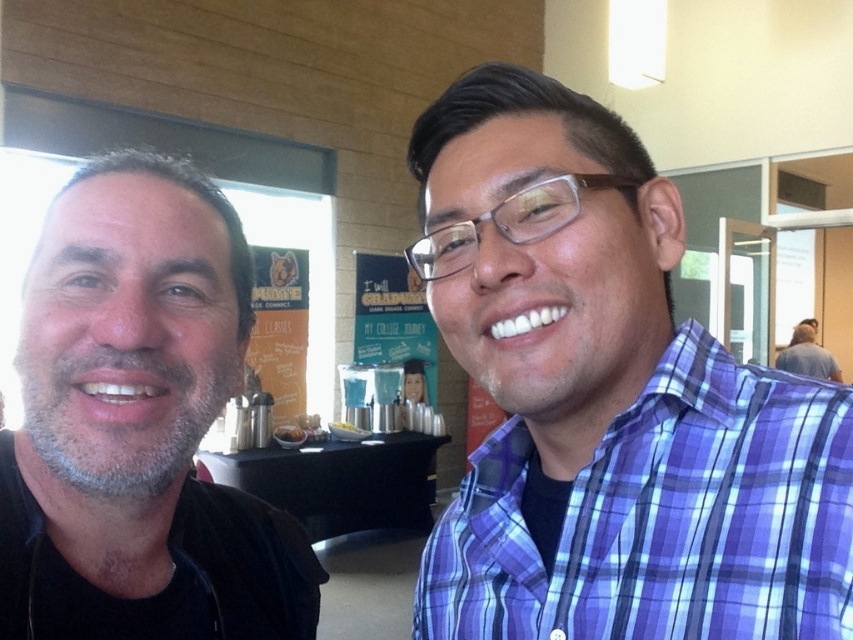
Which of these two, black glossy table at center or gray hair at upper right, stands taller?

With more height is black glossy table at center.

Is point (241, 483) less distant than point (798, 358)?

Yes, point (241, 483) is closer to viewer.

Does point (282, 497) lie behind point (828, 360)?

No.

Image resolution: width=853 pixels, height=640 pixels. What are the coordinates of `black glossy table at center` in the screenshot? It's located at (341, 481).

From the picture: Is purple plaid shirt at right to the right of black glossy table at center from the viewer's perspective?

Indeed, purple plaid shirt at right is positioned on the right side of black glossy table at center.

Which is behind, point (822, 484) or point (410, 524)?

Positioned behind is point (410, 524).

Locate an element on the screen. purple plaid shirt at right is located at coordinates (662, 516).

Locate an element on the screen. black matte shirt at left is located at coordinates (138, 426).